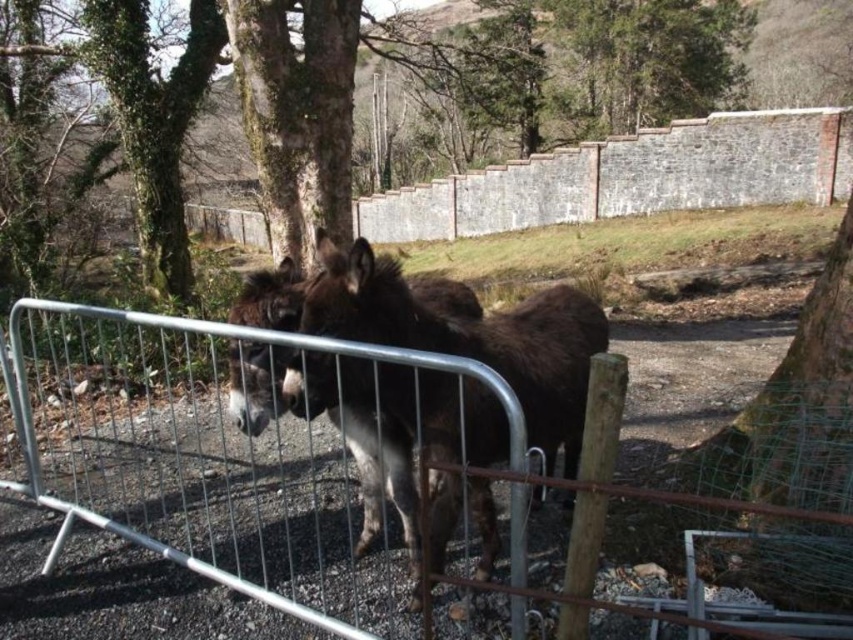
Is point (570, 468) positioned after point (262, 160)?

No, (570, 468) is in front of (262, 160).

Does dark brown fur mule at center appear on the right side of brown rough bark tree at upper center?

Indeed, dark brown fur mule at center is positioned on the right side of brown rough bark tree at upper center.

This screenshot has height=640, width=853. In order to click on dark brown fur mule at center in this screenshot , I will do `click(469, 337)`.

Who is shorter, silver metallic fence at center or brown rough bark tree at upper center?

silver metallic fence at center is shorter.

In the scene shown: How much distance is there between silver metallic fence at center and brown rough bark tree at upper center?

The distance of silver metallic fence at center from brown rough bark tree at upper center is 7.62 feet.

Locate an element on the screen. This screenshot has width=853, height=640. silver metallic fence at center is located at coordinates (340, 470).

Is silver metallic fence at center taller than dark brown fur mule at center?

In fact, silver metallic fence at center may be shorter than dark brown fur mule at center.

Can you confirm if silver metallic fence at center is positioned to the right of dark brown fur mule at center?

Incorrect, silver metallic fence at center is not on the right side of dark brown fur mule at center.

Between point (525, 552) and point (474, 490), which one is positioned in front?

Positioned in front is point (525, 552).

Where is `silver metallic fence at center`? This screenshot has height=640, width=853. silver metallic fence at center is located at coordinates (340, 470).